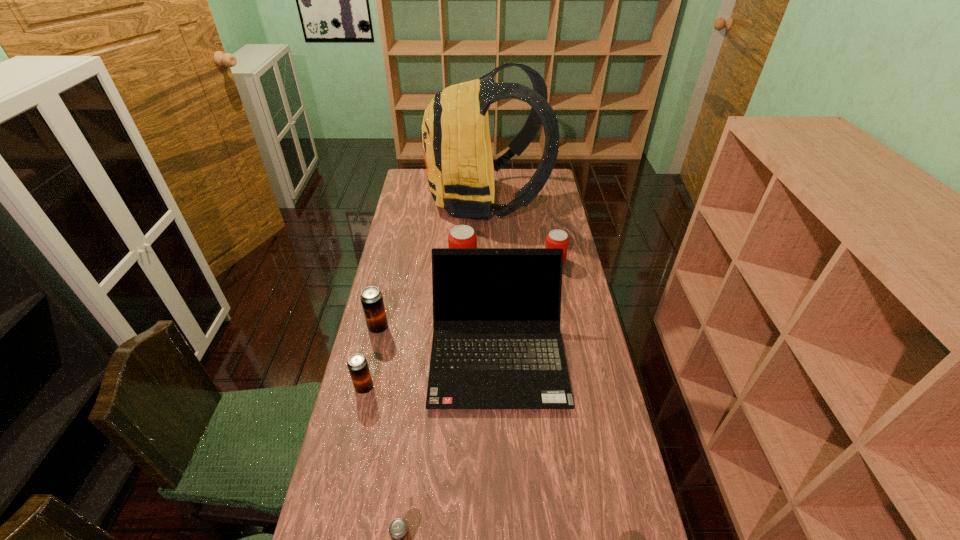
Identify the location of the farthest object. (460, 168).

This screenshot has width=960, height=540. In order to click on the tallest object in this screenshot , I will do `click(460, 168)`.

The width and height of the screenshot is (960, 540). Identify the location of black laptop computer. (497, 344).

Image resolution: width=960 pixels, height=540 pixels. What are the coordinates of `laptop computer` in the screenshot? It's located at (497, 344).

Image resolution: width=960 pixels, height=540 pixels. I want to click on the second beer can from right to left, so click(462, 236).

You are a GUI agent. You are given a task and a screenshot of the screen. Output one action in this format:
    pyautogui.click(x=<x>, y=<y>)
    Task: Click on the left red beer can
    
    Given the screenshot: What is the action you would take?
    pyautogui.click(x=462, y=236)

Find the location of a particular element. Image resolution: width=960 pixels, height=540 pixels. the farthest black beer can is located at coordinates (371, 297).

Find the location of a particular element. the third farthest beer can is located at coordinates (371, 297).

This screenshot has height=540, width=960. I want to click on the smaller red beer can, so click(556, 238).

Image resolution: width=960 pixels, height=540 pixels. What are the coordinates of `the rightmost beer can` in the screenshot? It's located at (556, 238).